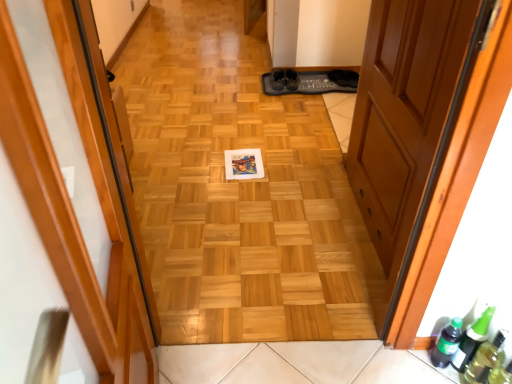
Question: Can you confirm if green matte bottle at lower right, which appears as the second beer bottle when viewed from the right, is positioned to the right of wooden floor at center?

Choices:
 (A) yes
 (B) no

Answer: (A)

Question: Is green matte bottle at lower right, which appears as the second beer bottle when viewed from the right, closer to the viewer compared to wooden floor at center?

Choices:
 (A) yes
 (B) no

Answer: (B)

Question: Is the surface of green matte bottle at lower right, which is counted as the 1th beer bottle, starting from the left, in direct contact with wooden floor at center?

Choices:
 (A) yes
 (B) no

Answer: (B)

Question: From the image's perspective, is green matte bottle at lower right, which is counted as the 1th beer bottle, starting from the left, under wooden floor at center?

Choices:
 (A) no
 (B) yes

Answer: (B)

Question: From the image's perspective, is green matte bottle at lower right, which is counted as the 1th beer bottle, starting from the left, on wooden floor at center?

Choices:
 (A) no
 (B) yes

Answer: (A)

Question: Visually, is transparent plastic bottle at lower right positioned to the left or to the right of green matte bottle at lower right, which is counted as the 1th beer bottle, starting from the left?

Choices:
 (A) right
 (B) left

Answer: (A)

Question: In terms of height, does transparent plastic bottle at lower right look taller or shorter compared to green matte bottle at lower right, which appears as the second beer bottle when viewed from the right?

Choices:
 (A) tall
 (B) short

Answer: (A)

Question: From the image's perspective, relative to green matte bottle at lower right, which is counted as the 1th beer bottle, starting from the left, is transparent plastic bottle at lower right above or below?

Choices:
 (A) below
 (B) above

Answer: (A)

Question: Considering the positions of transparent plastic bottle at lower right and green matte bottle at lower right, which appears as the second beer bottle when viewed from the right, in the image, is transparent plastic bottle at lower right bigger or smaller than green matte bottle at lower right, which appears as the second beer bottle when viewed from the right,?

Choices:
 (A) big
 (B) small

Answer: (A)

Question: In the image, is green glass beer bottle at lower right, positioned as the first beer bottle in right-to-left order, on the left side or the right side of wooden door at center, which ranks as the first door in right-to-left order?

Choices:
 (A) right
 (B) left

Answer: (A)

Question: Is point (468, 337) closer or farther from the camera than point (367, 132)?

Choices:
 (A) closer
 (B) farther

Answer: (A)

Question: Considering the positions of green glass beer bottle at lower right, acting as the second beer bottle starting from the left, and wooden door at center, which ranks as the first door in right-to-left order, in the image, is green glass beer bottle at lower right, acting as the second beer bottle starting from the left, taller or shorter than wooden door at center, which ranks as the first door in right-to-left order,?

Choices:
 (A) tall
 (B) short

Answer: (B)

Question: Considering the positions of green glass beer bottle at lower right, positioned as the first beer bottle in right-to-left order, and wooden door at center, the second door from the left, in the image, is green glass beer bottle at lower right, positioned as the first beer bottle in right-to-left order, bigger or smaller than wooden door at center, the second door from the left,?

Choices:
 (A) small
 (B) big

Answer: (A)

Question: Is point pos(444,339) positioned closer to the camera than point pos(403,4)?

Choices:
 (A) farther
 (B) closer

Answer: (B)

Question: Is green matte bottle at lower right, which is counted as the 1th beer bottle, starting from the left, bigger or smaller than wooden door at center, the second door from the left?

Choices:
 (A) small
 (B) big

Answer: (A)